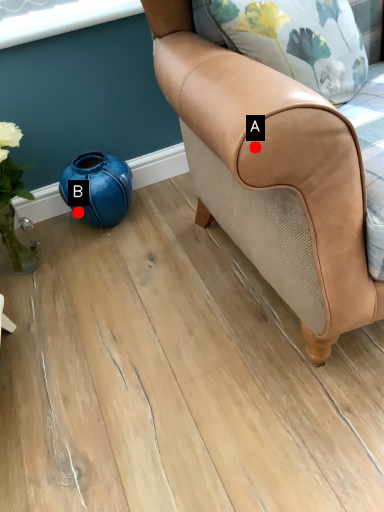
Question: Two points are circled on the image, labeled by A and B beside each circle. Which point is farther from the camera taking this photo?

Choices:
 (A) A is further
 (B) B is further

Answer: (B)